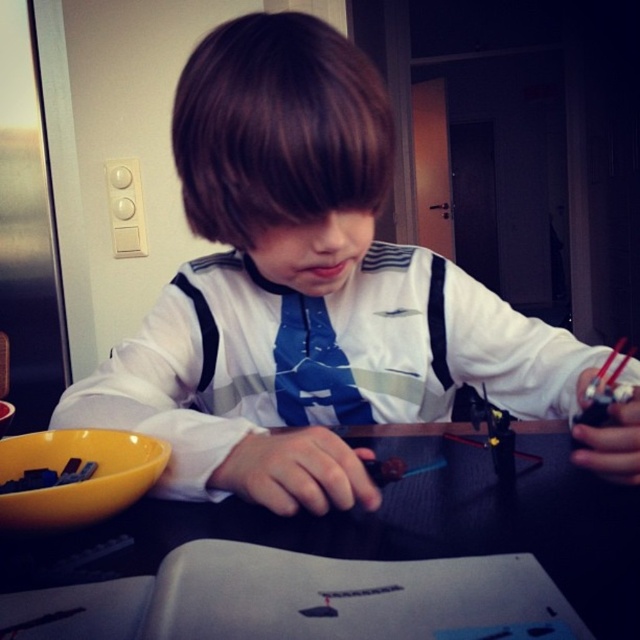
Question: Which of the following is the farthest from the observer?

Choices:
 (A) black plastic table at center
 (B) blue fabric tie at center
 (C) white matte shirt at center

Answer: (B)

Question: Where is white matte shirt at center located in relation to blue fabric tie at center in the image?

Choices:
 (A) right
 (B) left

Answer: (A)

Question: Can you confirm if white matte shirt at center is positioned above black plastic table at center?

Choices:
 (A) yes
 (B) no

Answer: (A)

Question: Which point is closer to the camera taking this photo?

Choices:
 (A) (333, 387)
 (B) (445, 365)
 (C) (138, 525)

Answer: (C)

Question: Which object is farther from the camera taking this photo?

Choices:
 (A) black plastic table at center
 (B) blue fabric tie at center
 (C) white matte shirt at center

Answer: (B)

Question: Is white matte shirt at center thinner than black plastic table at center?

Choices:
 (A) yes
 (B) no

Answer: (B)